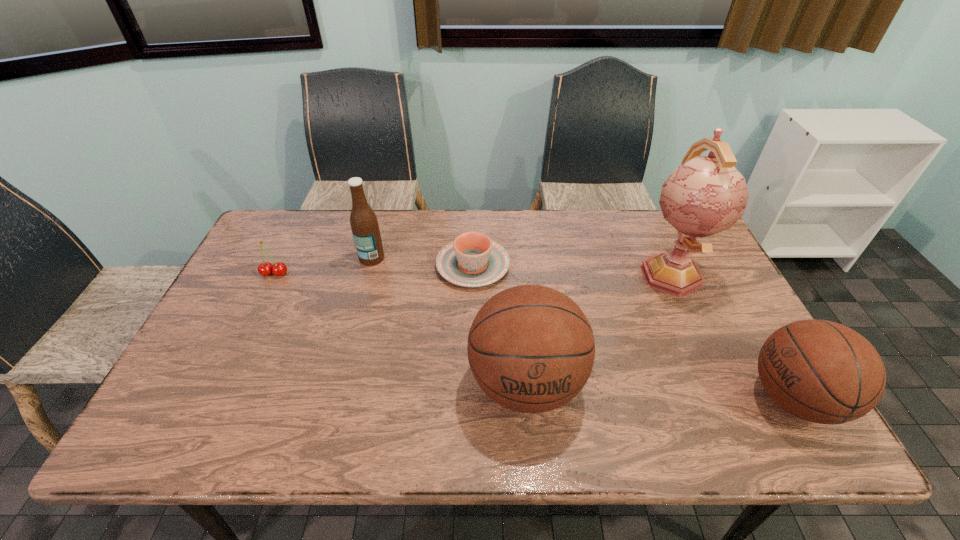
Find the location of a particular element. object at the left edge is located at coordinates (279, 269).

I want to click on basketball that is positioned at the right edge, so click(820, 371).

You are a GUI agent. You are given a task and a screenshot of the screen. Output one action in this format:
    pyautogui.click(x=<x>, y=<y>)
    Task: Click on the globe located at the right edge
    This screenshot has width=960, height=540.
    Given the screenshot: What is the action you would take?
    pyautogui.click(x=705, y=195)

This screenshot has height=540, width=960. What are the coordinates of `object that is at the far right corner` in the screenshot? It's located at (705, 195).

The width and height of the screenshot is (960, 540). Identify the location of object situated at the near right corner. (820, 371).

Identify the location of free space at the far edge of the desktop. (509, 254).

This screenshot has height=540, width=960. What are the coordinates of `vacant area at the near edge of the desktop` in the screenshot? It's located at point(422,390).

Find the location of a particular element. free spot at the left edge of the desktop is located at coordinates (248, 343).

This screenshot has width=960, height=540. Find the location of `vacant area at the right edge of the desktop`. vacant area at the right edge of the desktop is located at coordinates (735, 366).

The width and height of the screenshot is (960, 540). In order to click on free space at the near left corner of the desktop in this screenshot , I will do `click(183, 391)`.